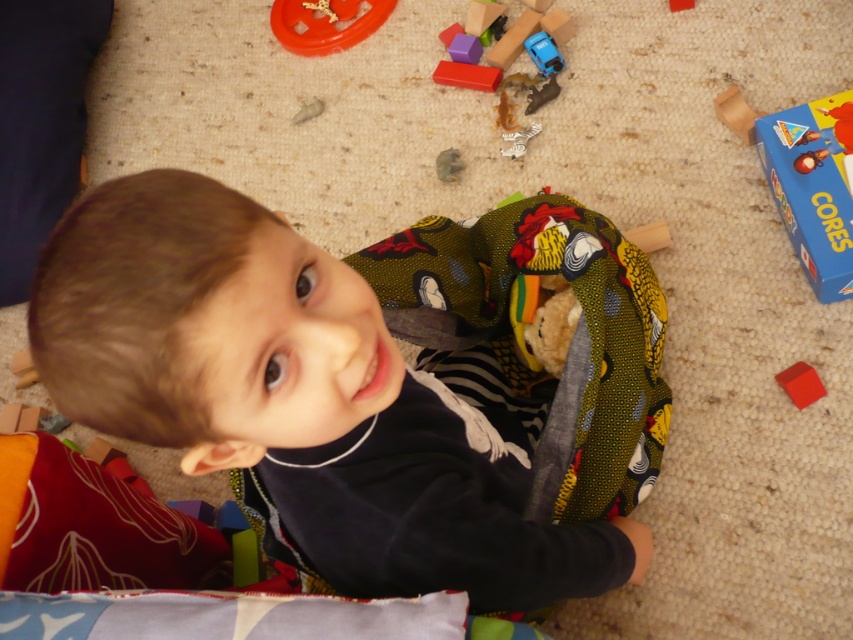
Question: Does wooden blocks at upper center have a greater width compared to red matte block at lower right?

Choices:
 (A) yes
 (B) no

Answer: (A)

Question: Among these points, which one is nearest to the camera?

Choices:
 (A) (820, 381)
 (B) (532, 44)
 (C) (483, 90)

Answer: (A)

Question: Based on their relative distances, which object is farther from the red matte block at lower right?

Choices:
 (A) metallic blue car at center
 (B) smooth skin child at center
 (C) wooden blocks at upper center
 (D) smooth red block at upper center

Answer: (D)

Question: Considering the relative positions of wooden blocks at upper center and smooth red block at upper center in the image provided, where is wooden blocks at upper center located with respect to smooth red block at upper center?

Choices:
 (A) above
 (B) below

Answer: (A)

Question: Among these objects, which one is farthest from the camera?

Choices:
 (A) smooth red block at upper center
 (B) wooden blocks at upper center
 (C) metallic blue car at center
 (D) red matte block at lower right

Answer: (A)

Question: In this image, where is red matte block at lower right located relative to metallic blue car at center?

Choices:
 (A) below
 (B) above

Answer: (A)